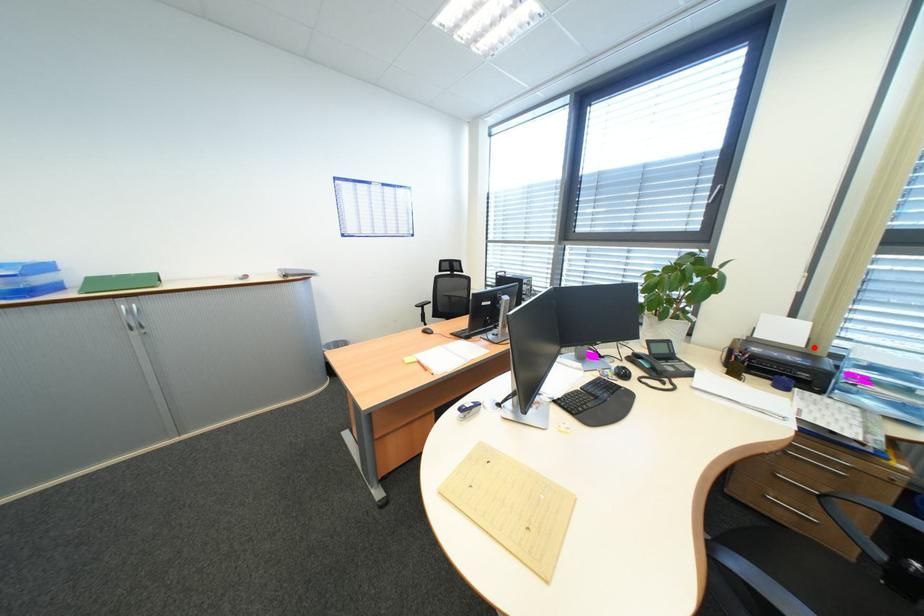
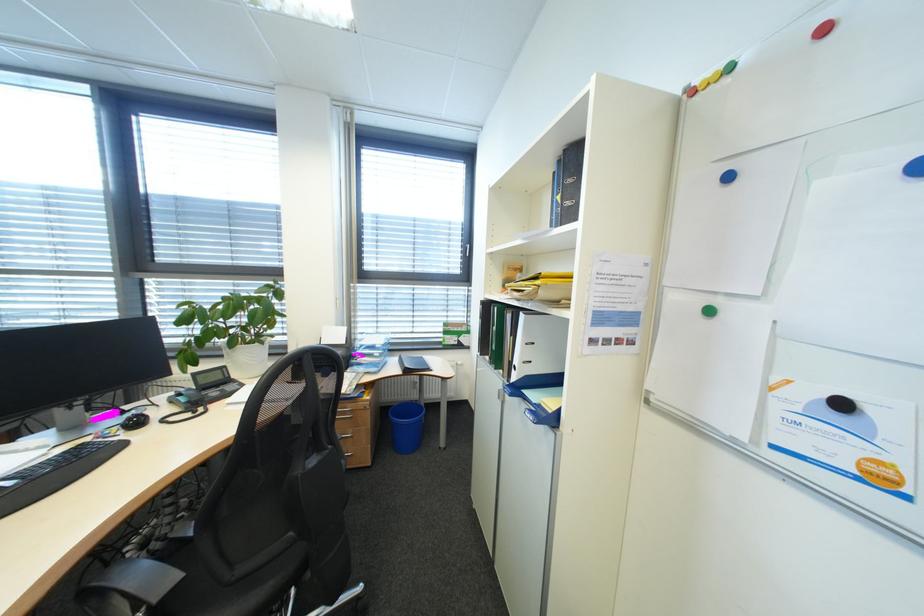
In the second image, find the point that corresponds to the highlighted location in the first image.

(355, 344)